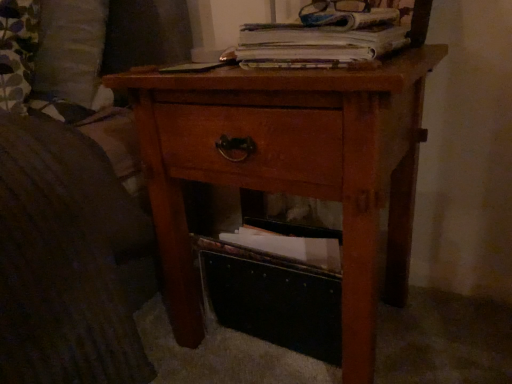
Question: From the image's perspective, is white paper at upper center located above or below black fabric storage box at lower center?

Choices:
 (A) below
 (B) above

Answer: (B)

Question: Is white paper at upper center inside the boundaries of black fabric storage box at lower center, or outside?

Choices:
 (A) inside
 (B) outside

Answer: (B)

Question: Which of these objects is positioned closest to the wooden nightstand at center?

Choices:
 (A) black fabric storage box at lower center
 (B) white paper at upper center

Answer: (A)

Question: Which of these objects is positioned farthest from the white paper at upper center?

Choices:
 (A) wooden nightstand at center
 (B) black fabric storage box at lower center

Answer: (B)